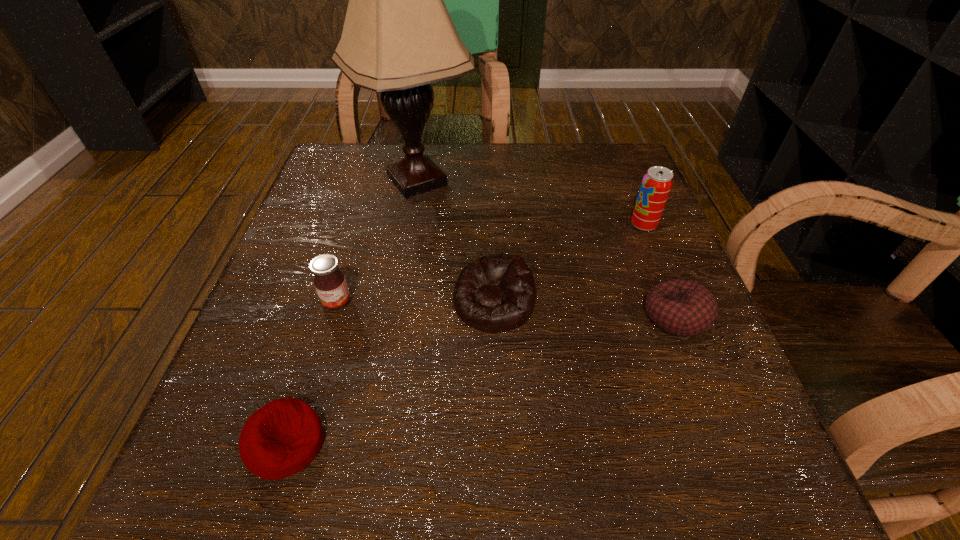
Select which beanbag appears as the second closest to the second beanbag from left to right. Please provide its 2D coordinates. Your answer should be formatted as a tuple, i.e. [(x, y)], where the tuple contains the x and y coordinates of a point satisfying the conditions above.

[(281, 438)]

Image resolution: width=960 pixels, height=540 pixels. What are the coordinates of `free space that satisfies the following two spatial constraints: 1. on the label side of the third tallest object; 2. on the seat area of the nearest beanbag` in the screenshot? It's located at (295, 443).

This screenshot has width=960, height=540. Find the location of `vacant space that satisfies the following two spatial constraints: 1. on the front side of the fifth shortest object; 2. on the seat area of the nearest beanbag`. vacant space that satisfies the following two spatial constraints: 1. on the front side of the fifth shortest object; 2. on the seat area of the nearest beanbag is located at coordinates (732, 443).